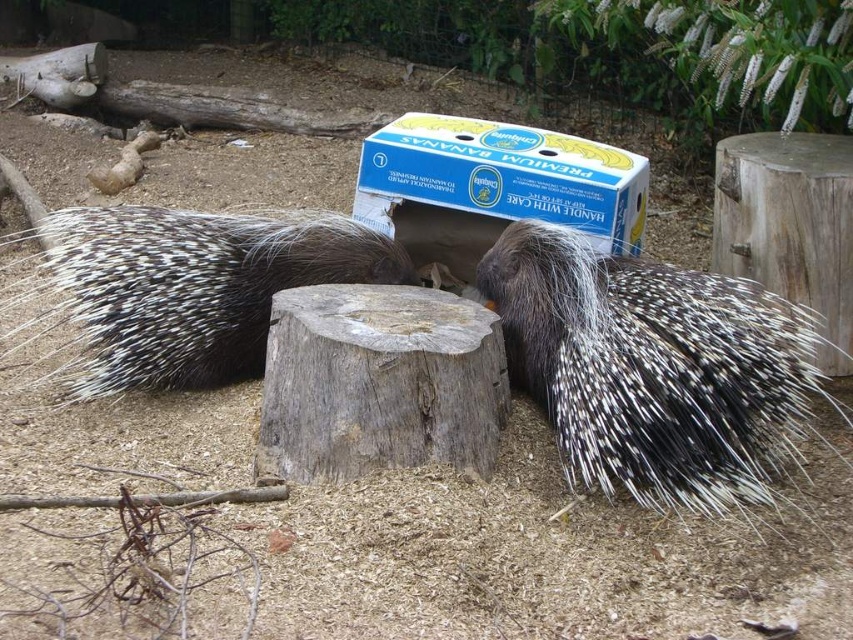
Can you confirm if spiny black hedgehog at center is taller than spiny brown hedgehog at center?

Correct, spiny black hedgehog at center is much taller as spiny brown hedgehog at center.

How much distance is there between spiny black hedgehog at center and spiny brown hedgehog at center?

95.05 centimeters

Measure the distance between point (622, 285) and camera.

Point (622, 285) and camera are 8.71 feet apart from each other.

The height and width of the screenshot is (640, 853). I want to click on spiny black hedgehog at center, so click(x=653, y=368).

Is point (119, 317) farther from camera compared to point (567, 224)?

That is False.

Is point (351, 257) closer to viewer compared to point (529, 177)?

Yes, point (351, 257) is in front of point (529, 177).

In order to click on spiny brown hedgehog at center in this screenshot , I will do `click(193, 288)`.

Is point (531, 348) less distant than point (643, 182)?

Yes, it is in front of point (643, 182).

The height and width of the screenshot is (640, 853). I want to click on spiny black hedgehog at center, so click(653, 368).

Identify the location of spiny black hedgehog at center. (653, 368).